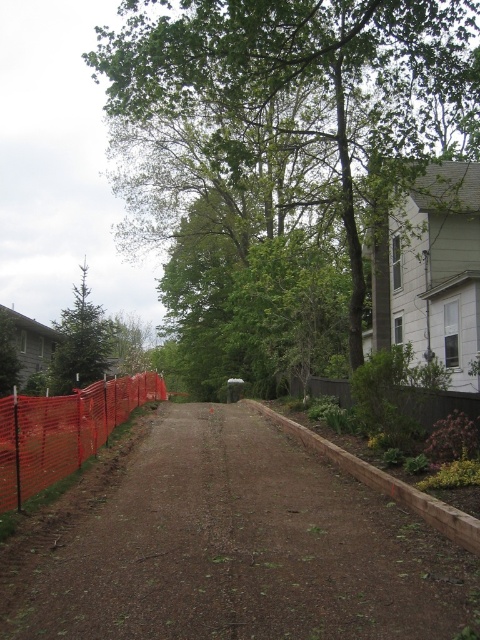
Question: In this image, where is green leafy tree at center located relative to brown wood fence at lower right?

Choices:
 (A) below
 (B) above

Answer: (B)

Question: Is orange mesh fence at left bigger than green matte tree at left?

Choices:
 (A) yes
 (B) no

Answer: (B)

Question: Where is green leafy tree at center located in relation to brown wood fence at lower right in the image?

Choices:
 (A) above
 (B) below

Answer: (A)

Question: Which object appears closest to the camera in this image?

Choices:
 (A) brown wood fence at lower right
 (B) green matte tree at left
 (C) orange mesh fence at left
 (D) green leafy tree at center

Answer: (C)

Question: Among these objects, which one is nearest to the camera?

Choices:
 (A) green matte tree at left
 (B) green leafy tree at center
 (C) orange mesh fence at left

Answer: (C)

Question: Estimate the real-world distances between objects in this image. Which object is closer to the green matte tree at left?

Choices:
 (A) brown wood fence at lower right
 (B) orange mesh fence at left
 (C) green leafy tree at center
 (D) brown dirt track at center

Answer: (B)